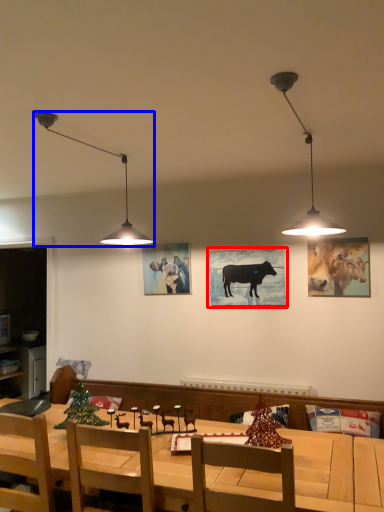
Question: Which object appears closest to the camera in this image, picture frame (highlighted by a red box) or lamp (highlighted by a blue box)?

Choices:
 (A) picture frame
 (B) lamp

Answer: (B)